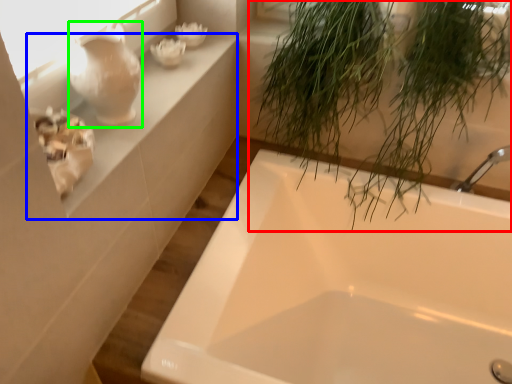
Question: Which object is the farthest from houseplant (highlighted by a red box)? Choose among these: window sill (highlighted by a blue box) or glass vase (highlighted by a green box).

Choices:
 (A) window sill
 (B) glass vase

Answer: (B)